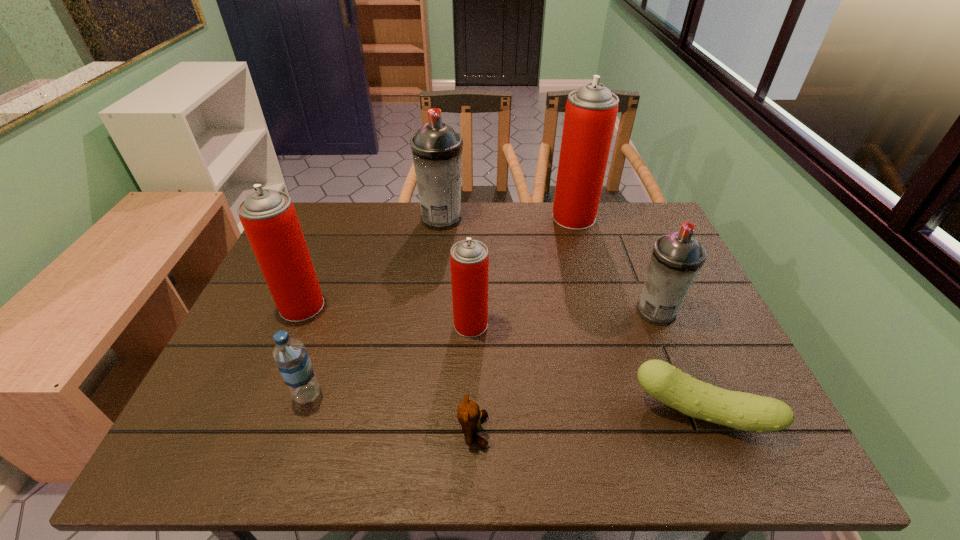
Find the location of a particular element. the seventh object from right to left is located at coordinates (290, 355).

Locate an element on the screen. The height and width of the screenshot is (540, 960). cucumber is located at coordinates (744, 411).

Identify the location of brown teddy bear. click(469, 415).

In order to click on free region located on the left of the tallest object in this screenshot , I will do `click(458, 218)`.

What are the coordinates of `free point located 0.330m on the front of the bigger gray aerosol can` in the screenshot? It's located at (432, 308).

Where is `free location located 0.390m on the back of the leftmost aerosol can`? free location located 0.390m on the back of the leftmost aerosol can is located at coordinates (342, 211).

Locate an element on the screen. free space located on the front of the second red aerosol can from left to right is located at coordinates (470, 361).

Locate an element on the screen. The height and width of the screenshot is (540, 960). free location located on the left of the smaller gray aerosol can is located at coordinates (541, 312).

The image size is (960, 540). I want to click on free space located 0.240m on the label of the sixth tallest object, so click(433, 394).

The width and height of the screenshot is (960, 540). I want to click on vacant space situated on the back of the cucumber, so click(641, 268).